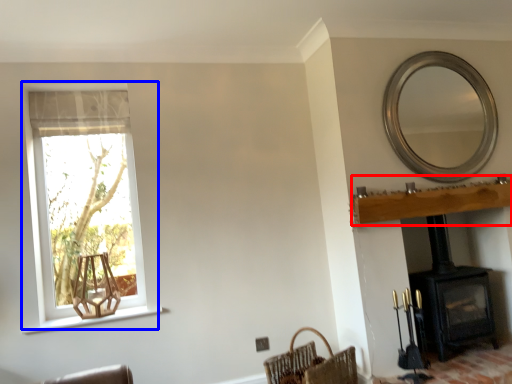
Question: Among these objects, which one is farthest to the camera, mantle (highlighted by a red box) or window (highlighted by a blue box)?

Choices:
 (A) mantle
 (B) window

Answer: (B)